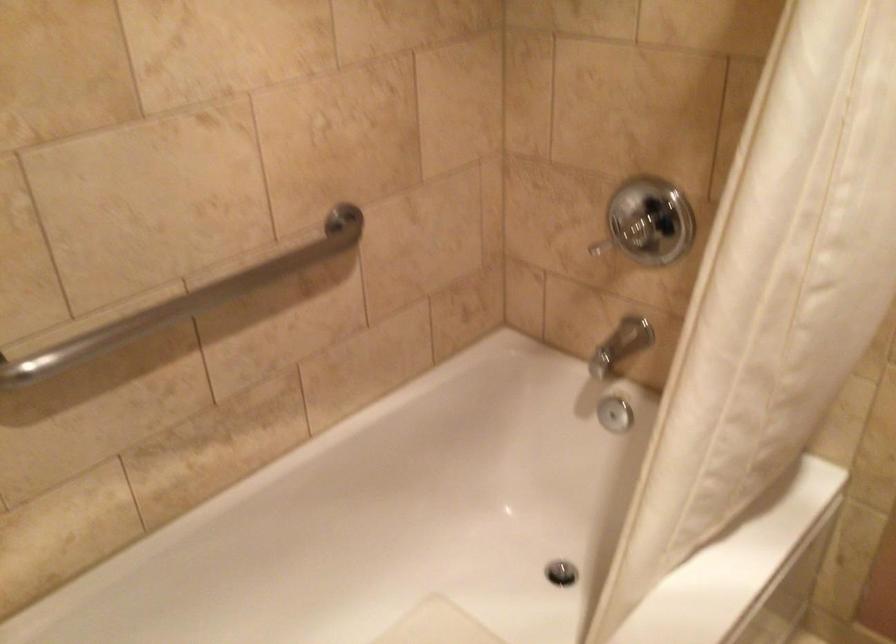
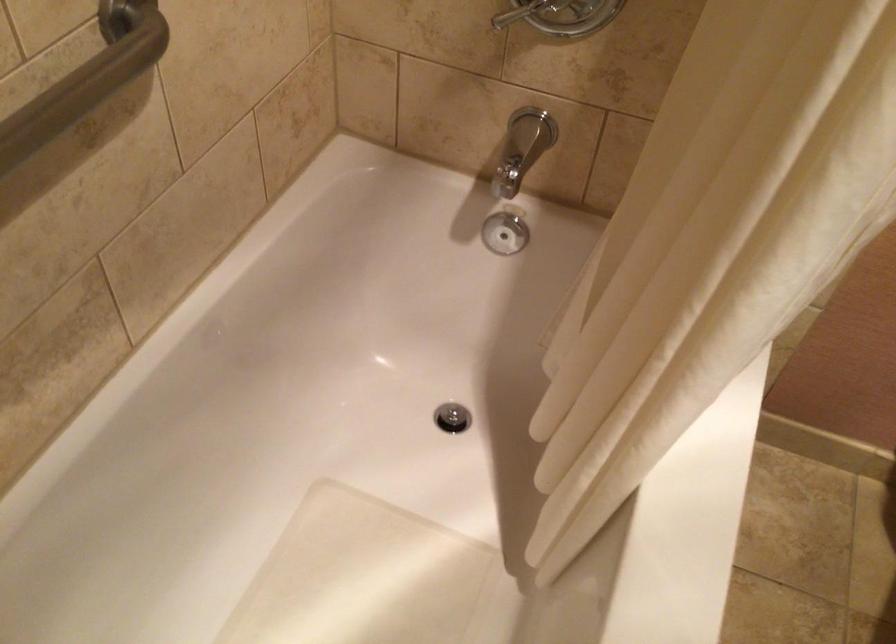
The first image is from the beginning of the video and the second image is from the end. How did the camera likely rotate when shooting the video?

The camera's rotation is toward right-down.